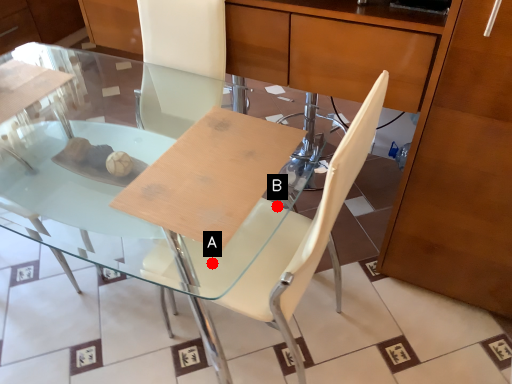
Question: Two points are circled on the image, labeled by A and B beside each circle. Which point is closer to the camera?

Choices:
 (A) A is closer
 (B) B is closer

Answer: (A)